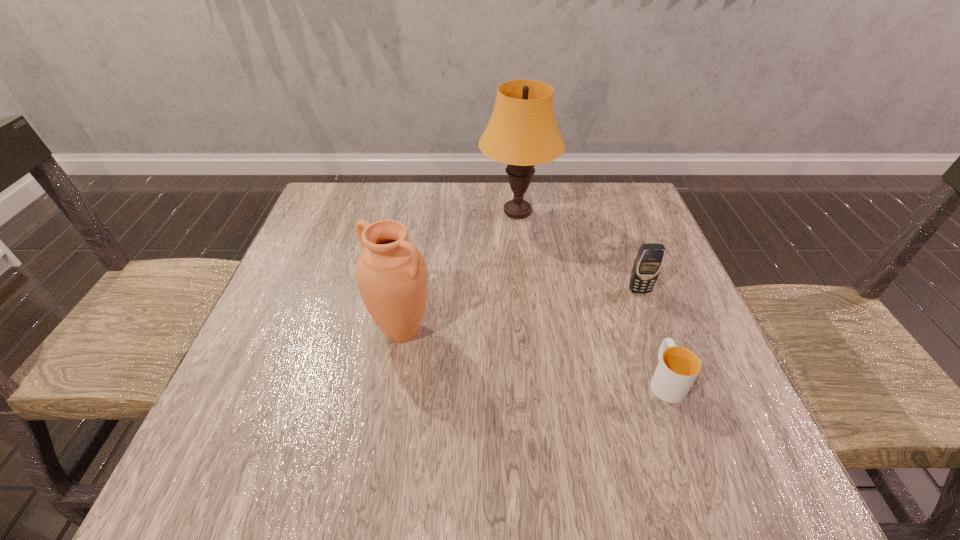
Where is `free spot located on the front face of the second shortest object`? free spot located on the front face of the second shortest object is located at coordinates (666, 362).

I want to click on free spot located 0.400m with the handle on the side of the shortest object, so tap(612, 232).

At what (x,y) coordinates should I click in order to perform the action: click on free space located 0.250m with the handle on the side of the shortest object. Please return your answer as a coordinate pair (x, y). The image size is (960, 540). Looking at the image, I should click on 626,271.

The width and height of the screenshot is (960, 540). In order to click on blank space located 0.150m with the handle on the side of the shortest object in this screenshot , I will do `click(637, 302)`.

The width and height of the screenshot is (960, 540). Find the location of `object at the far edge`. object at the far edge is located at coordinates (522, 132).

The width and height of the screenshot is (960, 540). I want to click on cellular telephone that is at the right edge, so click(649, 260).

At what (x,y) coordinates should I click in order to perform the action: click on cup at the right edge. Please return your answer as a coordinate pair (x, y). Looking at the image, I should click on (678, 367).

Find the location of a particular element. This screenshot has width=960, height=540. free space at the far edge of the desktop is located at coordinates (573, 186).

Find the location of a particular element. The image size is (960, 540). vacant space at the near edge of the desktop is located at coordinates [x=323, y=462].

The height and width of the screenshot is (540, 960). In order to click on blank space at the left edge of the desktop in this screenshot , I will do click(x=230, y=394).